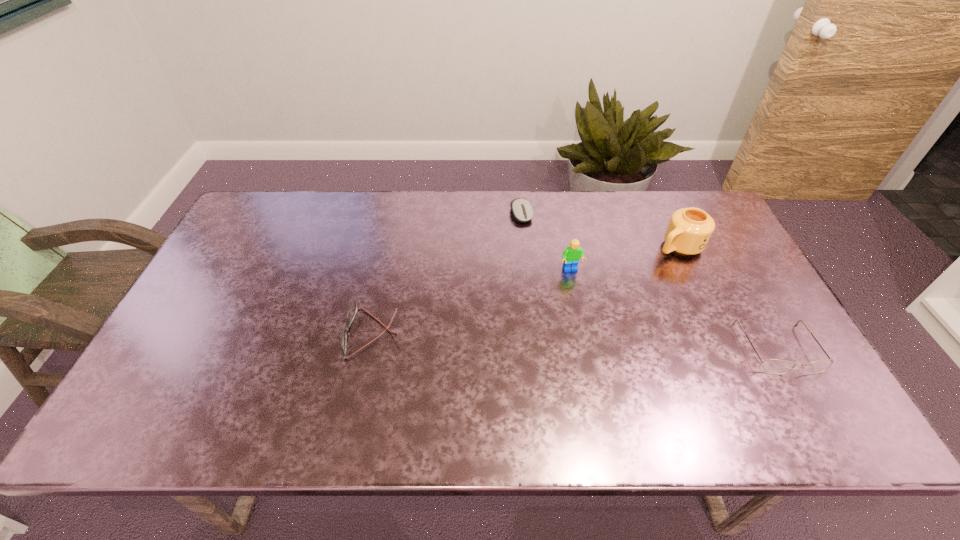
Where is `vacant space in between the left spectacles and the Lego`? Image resolution: width=960 pixels, height=540 pixels. vacant space in between the left spectacles and the Lego is located at coordinates (472, 302).

Image resolution: width=960 pixels, height=540 pixels. I want to click on unoccupied area between the mug and the computer equipment, so (x=600, y=230).

Choose which object is the nearest neighbor to the leftmost object. Please provide its 2D coordinates. Your answer should be formatted as a tuple, i.e. [(x, y)], where the tuple contains the x and y coordinates of a point satisfying the conditions above.

[(571, 255)]

You are a GUI agent. You are given a task and a screenshot of the screen. Output one action in this format:
    pyautogui.click(x=<x>, y=<y>)
    Task: Click on the object that is the fourth closest to the farthest object
    The width and height of the screenshot is (960, 540).
    Given the screenshot: What is the action you would take?
    pyautogui.click(x=771, y=366)